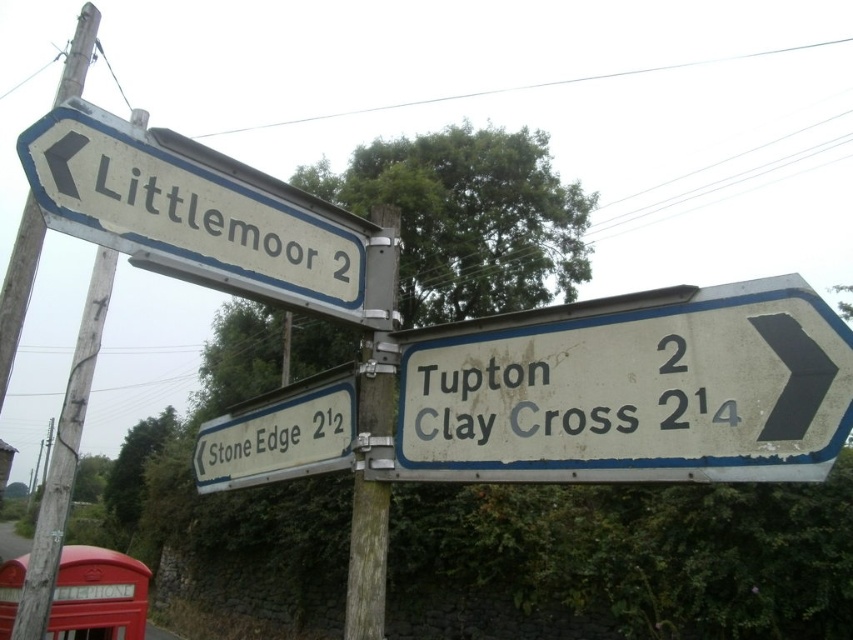
Is the position of white faded sign at right more distant than that of wooden pole at left?

No, it is not.

Does white faded sign at right have a lesser height compared to wooden pole at left?

Yes, white faded sign at right is shorter than wooden pole at left.

Find the location of a particular element. The image size is (853, 640). white faded sign at right is located at coordinates (634, 392).

Locate an element on the screen. The image size is (853, 640). white plastic sign at left is located at coordinates (196, 214).

Between point (167, 225) and point (30, 285), which one is positioned behind?

Point (30, 285)

At what (x,y) coordinates should I click in order to perform the action: click on white plastic sign at left. Please return your answer as a coordinate pair (x, y). The height and width of the screenshot is (640, 853). Looking at the image, I should click on (196, 214).

Does red painted metal telephone box at lower left have a lesser width compared to wooden post at center?

In fact, red painted metal telephone box at lower left might be wider than wooden post at center.

The image size is (853, 640). In order to click on red painted metal telephone box at lower left in this screenshot , I will do `click(97, 595)`.